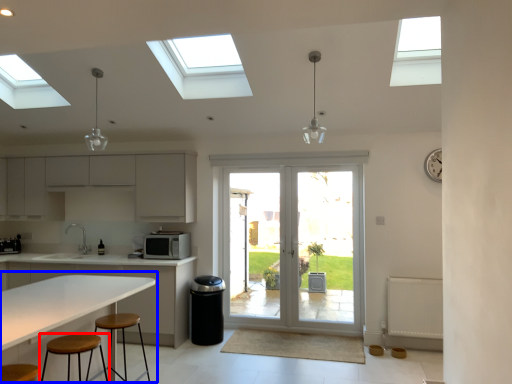
Question: Which object is further to the camera taking this photo, stool (highlighted by a red box) or table (highlighted by a blue box)?

Choices:
 (A) stool
 (B) table

Answer: (A)